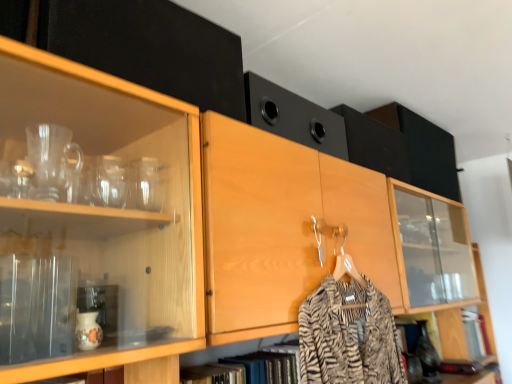
The image size is (512, 384). Describe the element at coordinates (294, 117) in the screenshot. I see `black matte speaker at upper center, acting as the 3th cabinetry starting from the right` at that location.

Based on the photo, how much space does wooden cabinet at lower right, placed as the first cabinetry when sorted from back to front, occupy vertically?

The height of wooden cabinet at lower right, placed as the first cabinetry when sorted from back to front, is 8.54 inches.

Identify the location of matte black cabinet at upper left, the fourth cabinetry positioned from the right. The height and width of the screenshot is (384, 512). tap(150, 48).

Consider the image. Is black matte speaker at upper center, acting as the 3th cabinetry starting from the right, wider than black matte speaker at upper center, the 3th cabinetry when ordered from top to bottom?

Incorrect, the width of black matte speaker at upper center, acting as the 3th cabinetry starting from the right, does not surpass that of black matte speaker at upper center, the 3th cabinetry when ordered from top to bottom.

Is black matte speaker at upper center, positioned as the 3th cabinetry in back-to-front order, completely or partially outside of black matte speaker at upper center, the 3th cabinetry when ordered from left to right?

Yes, black matte speaker at upper center, positioned as the 3th cabinetry in back-to-front order, is located beyond the bounds of black matte speaker at upper center, the 3th cabinetry when ordered from left to right.

From a real-world perspective, is black matte speaker at upper center, acting as the 3th cabinetry starting from the right, above or below black matte speaker at upper center, the 3th cabinetry when ordered from top to bottom?

black matte speaker at upper center, acting as the 3th cabinetry starting from the right, is below black matte speaker at upper center, the 3th cabinetry when ordered from top to bottom.

From the image's perspective, does black matte speaker at upper center, the 2th cabinetry from the right, appear lower than black matte speaker at upper center, acting as the 2th cabinetry starting from the left?

Yes, from the image's perspective, black matte speaker at upper center, the 2th cabinetry from the right, is beneath black matte speaker at upper center, acting as the 2th cabinetry starting from the left.

How many degrees apart are the facing directions of black matte speaker at upper center, the 3th cabinetry when ordered from top to bottom, and black matte speaker at upper center, which is the second cabinetry from top to bottom?

There is a 0.000611-degree angle between the facing directions of black matte speaker at upper center, the 3th cabinetry when ordered from top to bottom, and black matte speaker at upper center, which is the second cabinetry from top to bottom.

In the scene shown: Is black matte speaker at upper center, the 3th cabinetry viewed from the front, touching black matte speaker at upper center, the second cabinetry viewed from the front?

No, black matte speaker at upper center, the 3th cabinetry viewed from the front, is not touching black matte speaker at upper center, the second cabinetry viewed from the front.

From a real-world perspective, is black matte speaker at upper center, which ranks as the second cabinetry in back-to-front order, on black matte speaker at upper center, positioned as the 3th cabinetry in back-to-front order?

Correct, in the physical world, black matte speaker at upper center, which ranks as the second cabinetry in back-to-front order, is higher than black matte speaker at upper center, positioned as the 3th cabinetry in back-to-front order.

Is matte black cabinet at upper left, which is the 1th cabinetry from top to bottom, closer to the viewer compared to black matte speaker at upper center, positioned as the 3th cabinetry in back-to-front order?

Yes.

From a real-world perspective, which is physically above, matte black cabinet at upper left, the fourth cabinetry positioned from the right, or black matte speaker at upper center, acting as the 3th cabinetry starting from the right?

From a 3D spatial view, matte black cabinet at upper left, the fourth cabinetry positioned from the right, is above.

This screenshot has height=384, width=512. In order to click on the 1st cabinetry behind the matte black cabinet at upper left, the 1th cabinetry from the front, starting your count from the anchor in this screenshot , I will do `click(294, 117)`.

Considering the sizes of matte black cabinet at upper left, the 1th cabinetry from the front, and black matte speaker at upper center, which is the second cabinetry from top to bottom, in the image, is matte black cabinet at upper left, the 1th cabinetry from the front, wider or thinner than black matte speaker at upper center, which is the second cabinetry from top to bottom,?

A: Considering their sizes, matte black cabinet at upper left, the 1th cabinetry from the front, looks slimmer than black matte speaker at upper center, which is the second cabinetry from top to bottom.

Between black matte speaker at upper center, which appears as the 2th cabinetry when ordered from the bottom, and matte black cabinet at upper left, which is the 1th cabinetry from top to bottom, which one appears on the right side from the viewer's perspective?

black matte speaker at upper center, which appears as the 2th cabinetry when ordered from the bottom, is more to the right.

Is black matte speaker at upper center, which appears as the 2th cabinetry when ordered from the bottom, touching matte black cabinet at upper left, the fourth cabinetry positioned from the right?

No.

Considering the relative sizes of black matte speaker at upper center, the 2th cabinetry from the right, and matte black cabinet at upper left, which is the 1th cabinetry from top to bottom, in the image provided, is black matte speaker at upper center, the 2th cabinetry from the right, smaller than matte black cabinet at upper left, which is the 1th cabinetry from top to bottom,?

Actually, black matte speaker at upper center, the 2th cabinetry from the right, might be larger than matte black cabinet at upper left, which is the 1th cabinetry from top to bottom.

Is black matte speaker at upper center, the 3th cabinetry when ordered from left to right, oriented towards matte black cabinet at upper left, acting as the fourth cabinetry starting from the back?

No, black matte speaker at upper center, the 3th cabinetry when ordered from left to right, is not oriented towards matte black cabinet at upper left, acting as the fourth cabinetry starting from the back.

From a real-world perspective, is matte black cabinet at upper left, which ranks as the first cabinetry in left-to-right order, physically located above or below black matte speaker at upper center, the 3th cabinetry viewed from the front?

From a real-world perspective, matte black cabinet at upper left, which ranks as the first cabinetry in left-to-right order, is physically below black matte speaker at upper center, the 3th cabinetry viewed from the front.

Consider the image. Between matte black cabinet at upper left, the fourth cabinetry when ordered from bottom to top, and black matte speaker at upper center, the 3th cabinetry when ordered from left to right, which one appears on the right side from the viewer's perspective?

black matte speaker at upper center, the 3th cabinetry when ordered from left to right.

From the image's perspective, who appears lower, matte black cabinet at upper left, which ranks as the first cabinetry in left-to-right order, or black matte speaker at upper center, which appears as the 2th cabinetry when ordered from the bottom?

black matte speaker at upper center, which appears as the 2th cabinetry when ordered from the bottom, appears lower in the image.

Between point (125, 57) and point (359, 137), which one is positioned in front?

Point (125, 57)

Looking at this image, which object is thinner, black matte speaker at upper center, which appears as the 2th cabinetry when ordered from the bottom, or wooden cabinet at lower right, which appears as the 1th cabinetry when ordered from the bottom?

wooden cabinet at lower right, which appears as the 1th cabinetry when ordered from the bottom.

From the image's perspective, is black matte speaker at upper center, the 3th cabinetry when ordered from top to bottom, positioned above or below wooden cabinet at lower right, the fourth cabinetry in the top-to-bottom sequence?

From the image's perspective, black matte speaker at upper center, the 3th cabinetry when ordered from top to bottom, appears above wooden cabinet at lower right, the fourth cabinetry in the top-to-bottom sequence.

I want to click on the 1st cabinetry in front of the wooden cabinet at lower right, which appears as the 1th cabinetry when ordered from the bottom, counting from the anchor's position, so click(x=374, y=144).

Does point (355, 140) come closer to viewer compared to point (458, 345)?

Yes, point (355, 140) is in front of point (458, 345).

Is point (294, 94) less distant than point (128, 44)?

No, (294, 94) is further to viewer.

Considering their positions, is black matte speaker at upper center, the second cabinetry viewed from the front, located in front of or behind matte black cabinet at upper left, the fourth cabinetry positioned from the right?

Visually, black matte speaker at upper center, the second cabinetry viewed from the front, is located behind matte black cabinet at upper left, the fourth cabinetry positioned from the right.

Considering the relative positions of black matte speaker at upper center, positioned as the 3th cabinetry in back-to-front order, and matte black cabinet at upper left, the fourth cabinetry when ordered from bottom to top, in the image provided, is black matte speaker at upper center, positioned as the 3th cabinetry in back-to-front order, to the left or to the right of matte black cabinet at upper left, the fourth cabinetry when ordered from bottom to top,?

black matte speaker at upper center, positioned as the 3th cabinetry in back-to-front order, is positioned on matte black cabinet at upper left, the fourth cabinetry when ordered from bottom to top,'s right side.

Is black matte speaker at upper center, which is counted as the third cabinetry, starting from the bottom, with matte black cabinet at upper left, which is the 1th cabinetry from top to bottom?

No, black matte speaker at upper center, which is counted as the third cabinetry, starting from the bottom, is not with matte black cabinet at upper left, which is the 1th cabinetry from top to bottom.

Where is `cabinetry that is the 1st one when counting leftward from the black matte speaker at upper center, the 3th cabinetry when ordered from left to right`? The image size is (512, 384). cabinetry that is the 1st one when counting leftward from the black matte speaker at upper center, the 3th cabinetry when ordered from left to right is located at coordinates (294, 117).

You are a GUI agent. You are given a task and a screenshot of the screen. Output one action in this format:
    pyautogui.click(x=<x>, y=<y>)
    Task: Click on the 1st cabinetry behind the black matte speaker at upper center, acting as the 3th cabinetry starting from the right
    
    Given the screenshot: What is the action you would take?
    pyautogui.click(x=374, y=144)

Based on their spatial positions, is matte black cabinet at upper left, which is the 1th cabinetry from top to bottom, or black matte speaker at upper center, which ranks as the second cabinetry in back-to-front order, closer to wooden cabinet at lower right, which is counted as the 4th cabinetry, starting from the front?

Based on the image, black matte speaker at upper center, which ranks as the second cabinetry in back-to-front order, appears to be nearer to wooden cabinet at lower right, which is counted as the 4th cabinetry, starting from the front.

Estimate the real-world distances between objects in this image. Which object is closer to matte black cabinet at upper left, acting as the fourth cabinetry starting from the back, black matte speaker at upper center, which appears as the 2th cabinetry when ordered from the bottom, or wooden cabinet at lower right, which appears as the 1th cabinetry when ordered from the bottom?

black matte speaker at upper center, which appears as the 2th cabinetry when ordered from the bottom, lies closer to matte black cabinet at upper left, acting as the fourth cabinetry starting from the back, than the other object.

Looking at the image, which one is located closer to wooden cabinet at lower right, the 4th cabinetry in the left-to-right sequence, black matte speaker at upper center, the 3th cabinetry viewed from the front, or matte black cabinet at upper left, which ranks as the first cabinetry in left-to-right order?

The object closer to wooden cabinet at lower right, the 4th cabinetry in the left-to-right sequence, is black matte speaker at upper center, the 3th cabinetry viewed from the front.

Based on their spatial positions, is black matte speaker at upper center, the second cabinetry viewed from the front, or black matte speaker at upper center, which appears as the 2th cabinetry when ordered from the bottom, closer to matte black cabinet at upper left, the fourth cabinetry when ordered from bottom to top?

The object closer to matte black cabinet at upper left, the fourth cabinetry when ordered from bottom to top, is black matte speaker at upper center, the second cabinetry viewed from the front.

Estimate the real-world distances between objects in this image. Which object is closer to black matte speaker at upper center, the 3th cabinetry viewed from the front, matte black cabinet at upper left, acting as the fourth cabinetry starting from the back, or black matte speaker at upper center, which is the second cabinetry from top to bottom?

black matte speaker at upper center, which is the second cabinetry from top to bottom.

Considering their positions, is black matte speaker at upper center, the 2th cabinetry from the right, positioned closer to wooden cabinet at lower right, which is counted as the 4th cabinetry, starting from the front, than black matte speaker at upper center, positioned as the 3th cabinetry in back-to-front order?

black matte speaker at upper center, the 2th cabinetry from the right.

Looking at this image, considering their positions, is black matte speaker at upper center, which appears as the 2th cabinetry when ordered from the bottom, positioned further to black matte speaker at upper center, which is the second cabinetry from top to bottom, than matte black cabinet at upper left, the 1th cabinetry from the front?

matte black cabinet at upper left, the 1th cabinetry from the front.

Estimate the real-world distances between objects in this image. Which object is closer to black matte speaker at upper center, the 3th cabinetry viewed from the front, black matte speaker at upper center, acting as the 3th cabinetry starting from the right, or matte black cabinet at upper left, the 1th cabinetry from the front?

black matte speaker at upper center, acting as the 3th cabinetry starting from the right.

Find the location of `cabinetry between black matte speaker at upper center, acting as the 2th cabinetry starting from the left, and wooden cabinet at lower right, placed as the first cabinetry when sorted from back to front, vertically`. cabinetry between black matte speaker at upper center, acting as the 2th cabinetry starting from the left, and wooden cabinet at lower right, placed as the first cabinetry when sorted from back to front, vertically is located at coordinates (374, 144).

Image resolution: width=512 pixels, height=384 pixels. Identify the location of cabinetry located between matte black cabinet at upper left, the fourth cabinetry when ordered from bottom to top, and black matte speaker at upper center, the 3th cabinetry when ordered from top to bottom, in the depth direction. (294, 117).